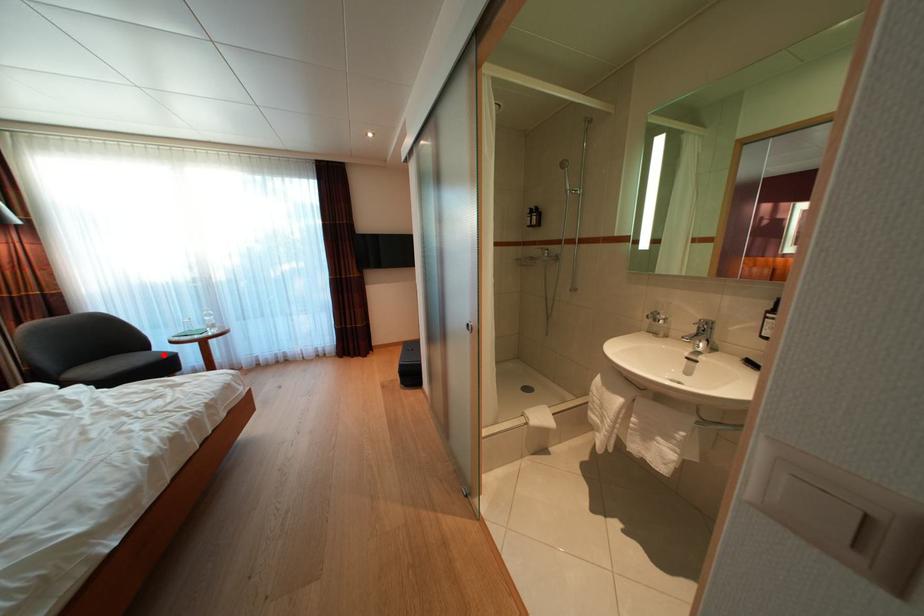
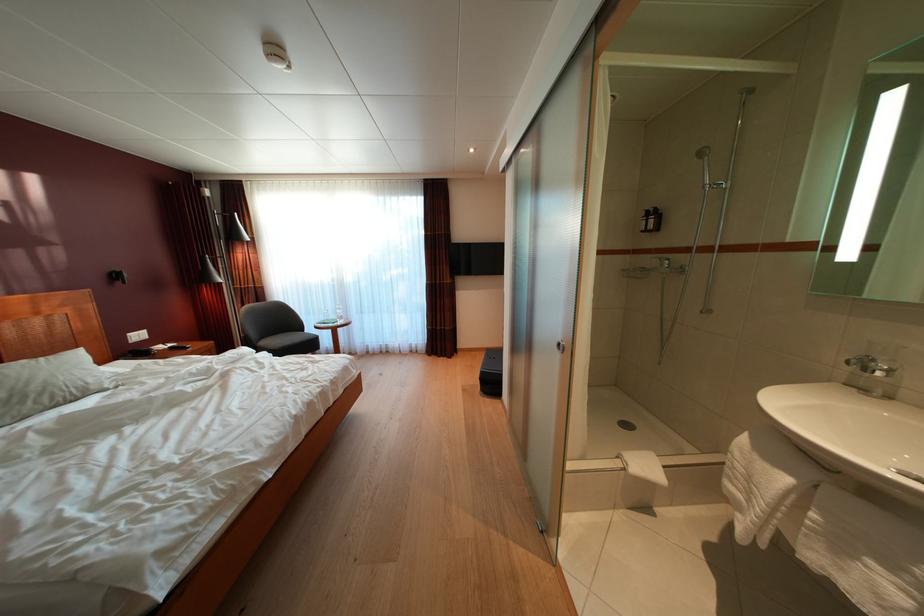
Question: I am providing you with two images of the same scene from different viewpoints. Image1 has a red point marked. In image2, the corresponding 3D location appears at what relative position? Reply with the corresponding letter.

Choices:
 (A) Closer
 (B) Farther

Answer: (B)